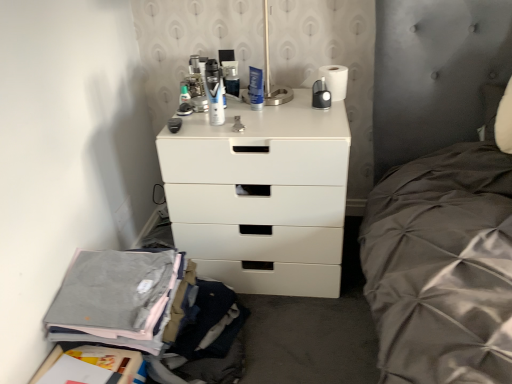
Locate an element on the screen. vacant area that is situated to the right of translucent plastic toothbrush at upper center, acting as the 2th toiletry starting from the back is located at coordinates (232, 105).